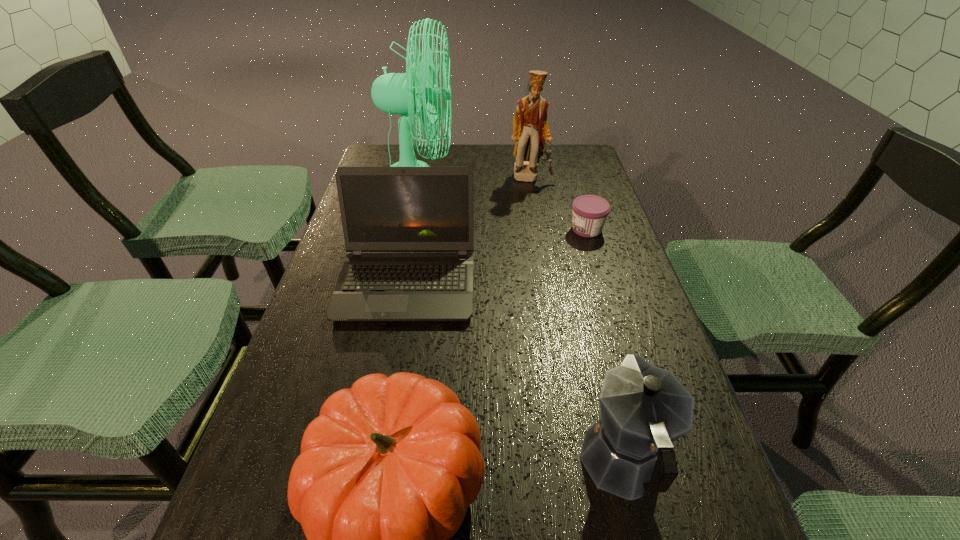
Where is `coffeepot present at the right edge`? This screenshot has height=540, width=960. coffeepot present at the right edge is located at coordinates (628, 452).

You are a GUI agent. You are given a task and a screenshot of the screen. Output one action in this format:
    pyautogui.click(x=<x>, y=<y>)
    Task: Click on the jam present at the right edge
    This screenshot has width=960, height=540.
    Given the screenshot: What is the action you would take?
    pyautogui.click(x=590, y=212)

Where is `object at the far left corner`? This screenshot has height=540, width=960. object at the far left corner is located at coordinates (x=395, y=93).

This screenshot has height=540, width=960. I want to click on object that is at the far right corner, so click(x=531, y=132).

At what (x,y) coordinates should I click in order to perform the action: click on vacant space at the far edge of the desktop. Please return your answer as a coordinate pair (x, y). Looking at the image, I should click on (499, 161).

You are a GUI agent. You are given a task and a screenshot of the screen. Output one action in this format:
    pyautogui.click(x=<x>, y=<y>)
    Task: Click on the vacant space at the left edge
    The image size is (960, 540).
    Given the screenshot: What is the action you would take?
    pyautogui.click(x=304, y=423)

I want to click on blank space at the right edge, so click(597, 178).

You are a GUI agent. You are given a task and a screenshot of the screen. Output one action in this format:
    pyautogui.click(x=<x>, y=<y>)
    Task: Click on the free region at the far right corner of the desktop
    
    Given the screenshot: What is the action you would take?
    pyautogui.click(x=573, y=147)

This screenshot has width=960, height=540. I want to click on vacant area between the shortest object and the coffeepot, so click(605, 347).

You are a GUI agent. You are given a task and a screenshot of the screen. Output one action in this format:
    pyautogui.click(x=<x>, y=<y>)
    Task: Click on the free spot between the fan and the fifth shortest object
    This screenshot has height=540, width=960.
    Given the screenshot: What is the action you would take?
    pyautogui.click(x=475, y=179)